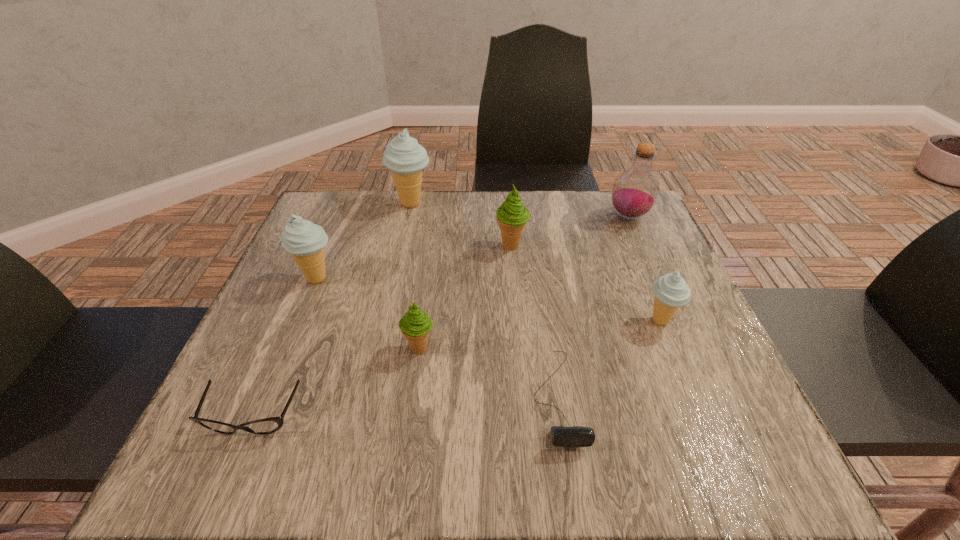
Where is `the farthest icecream`? The width and height of the screenshot is (960, 540). the farthest icecream is located at coordinates (404, 157).

Where is `the biggest beige icecream`? the biggest beige icecream is located at coordinates (404, 157).

Where is `bottle`? The width and height of the screenshot is (960, 540). bottle is located at coordinates (635, 191).

Locate an element on the screen. This screenshot has width=960, height=540. the bigger green icecream is located at coordinates (512, 216).

You are a GUI agent. You are given a task and a screenshot of the screen. Output one action in this format:
    pyautogui.click(x=<x>, y=<y>)
    Task: Click on the second farthest icecream
    
    Given the screenshot: What is the action you would take?
    pyautogui.click(x=512, y=216)

This screenshot has width=960, height=540. I want to click on the second smallest beige icecream, so click(305, 241).

Identify the location of the second nearest beige icecream. (305, 241).

The width and height of the screenshot is (960, 540). I want to click on the fourth nearest object, so click(x=671, y=291).

This screenshot has height=540, width=960. I want to click on the fourth farthest icecream, so click(x=671, y=291).

Where is `the nearer green icecream`? the nearer green icecream is located at coordinates (415, 325).